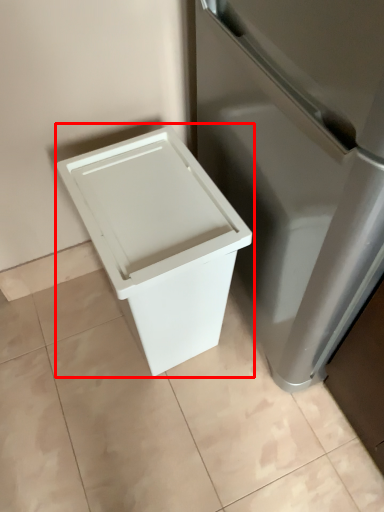
Question: From the image's perspective, what is the correct spatial relationship of waste container (annotated by the red box) in relation to tile?

Choices:
 (A) below
 (B) above

Answer: (B)